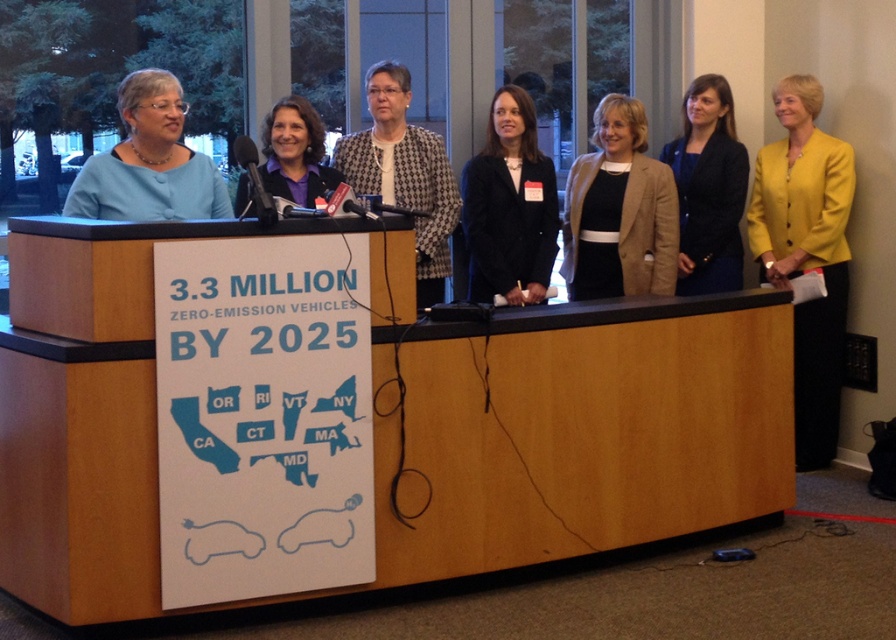
You are a photographer at the event and need to capture a clear photo of both the yellow fabric jacket at right and the black matte blazer at center. However, the podium with the sign is blocking your view. Can you adjust your position so that both are visible without the podium obstructing either?

The yellow fabric jacket at right is positioned under the black matte blazer at center, so moving to the right side might allow you to see the yellow fabric jacket at right below the black matte blazer at center while still capturing the black matte blazer at center in the frame.

You are a photographer at the event and need to capture a photo where both the yellow fabric jacket at right and the black matte blazer at center are visible. Considering their sizes, which one might you need to position closer to the camera to ensure both fit in the frame?

The yellow fabric jacket at right is bigger than the black matte blazer at center, so positioning the black matte blazer at center closer to the camera would help ensure both fit in the frame since the larger jacket can be captured from a slightly farther distance while still being visible.